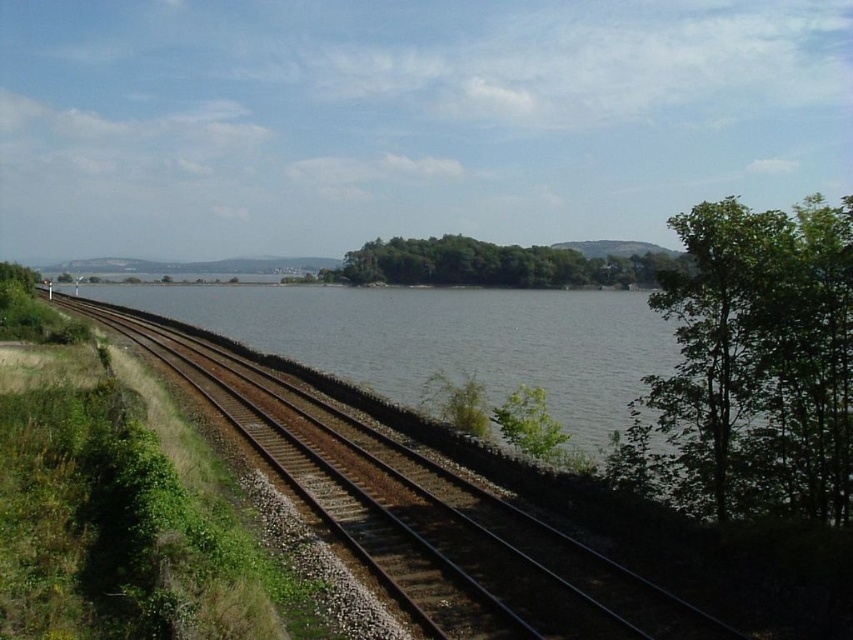
You are standing on the railway track and want to walk towards the green leafy tree at right and the green leafy island at center. Which one will you reach first?

You will reach the green leafy tree at right first because it is closer to you than the green leafy island at center.

You are a landscape photographer planning to capture the scene with both the green leafy tree at right and the green leafy island at center in your shot. Which of the two will appear smaller in your photograph?

The green leafy tree at right will appear smaller in the photograph because it occupies less space than the green leafy island at center.